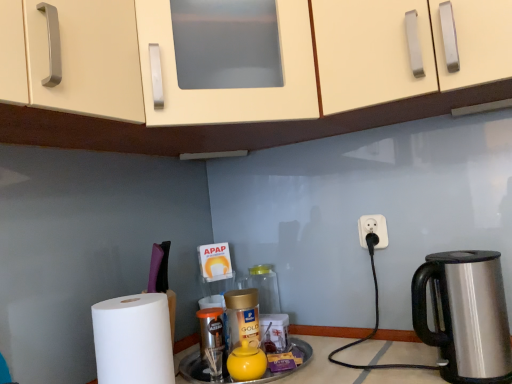
What do you see at coordinates (296, 80) in the screenshot?
I see `matte cream cabinet at upper center` at bounding box center [296, 80].

Describe the element at coordinates (373, 230) in the screenshot. This screenshot has width=512, height=384. I see `white plastic power outlet at right` at that location.

What do you see at coordinates (265, 287) in the screenshot? I see `gold metallic jar at center, the first bottle in the back-to-front sequence` at bounding box center [265, 287].

Where is `gold plastic bottle at center, which ranks as the 1th bottle in front-to-back order`? The image size is (512, 384). gold plastic bottle at center, which ranks as the 1th bottle in front-to-back order is located at coordinates (242, 318).

This screenshot has width=512, height=384. Describe the element at coordinates (133, 340) in the screenshot. I see `white matte paper towel at lower left` at that location.

Identify the location of white matte paper towel at lower left. This screenshot has height=384, width=512. (133, 340).

Find the location of a particular element. The image size is (512, 384). matte cream cabinet at upper center is located at coordinates (296, 80).

Does matte cream cabinet at upper center appear on the left side of yellow matte tea pot at center?

No.

Is matte cream cabinet at upper center wider or thinner than yellow matte tea pot at center?

matte cream cabinet at upper center is wider than yellow matte tea pot at center.

Is matte cream cabinet at upper center positioned far away from yellow matte tea pot at center?

No, there isn't a large distance between matte cream cabinet at upper center and yellow matte tea pot at center.

Is matte cream cabinet at upper center facing towards yellow matte tea pot at center?

No, matte cream cabinet at upper center is not turned towards yellow matte tea pot at center.

How much distance is there between white matte paper towel at lower left and white plastic power outlet at right?

A distance of 26.30 inches exists between white matte paper towel at lower left and white plastic power outlet at right.

Is white matte paper towel at lower left facing away from white plastic power outlet at right?

No, white plastic power outlet at right is not at the back of white matte paper towel at lower left.

Is white matte paper towel at lower left in front of or behind white plastic power outlet at right in the image?

white matte paper towel at lower left is positioned closer to the viewer than white plastic power outlet at right.

Between white matte paper towel at lower left and white plastic power outlet at right, which one appears on the right side from the viewer's perspective?

From the viewer's perspective, white plastic power outlet at right appears more on the right side.

Which object is more forward, stainless steel kettle at right or white plastic power outlet at right?

stainless steel kettle at right is more forward.

Can you confirm if stainless steel kettle at right is thinner than white plastic power outlet at right?

No, stainless steel kettle at right is not thinner than white plastic power outlet at right.

Is white plastic power outlet at right a part of stainless steel kettle at right?

No, white plastic power outlet at right is located outside of stainless steel kettle at right.

Is gold metallic jar at center, positioned as the 2th bottle in front-to-back order, in front of or behind white plastic power outlet at right in the image?

gold metallic jar at center, positioned as the 2th bottle in front-to-back order, is positioned farther from the viewer than white plastic power outlet at right.

Can you confirm if gold metallic jar at center, the first bottle in the back-to-front sequence, is shorter than white plastic power outlet at right?

No.

Is gold metallic jar at center, positioned as the 2th bottle in front-to-back order, touching white plastic power outlet at right?

No, gold metallic jar at center, positioned as the 2th bottle in front-to-back order, is not beside white plastic power outlet at right.

Locate an element on the screen. The height and width of the screenshot is (384, 512). power outlet above the gold metallic jar at center, the first bottle in the back-to-front sequence (from a real-world perspective) is located at coordinates (373, 230).

Which object is closer to the camera, stainless steel kettle at right or yellow matte tea pot at center?

stainless steel kettle at right is closer to the camera.

Is point (505, 331) positioned behind point (261, 350)?

No, (505, 331) is closer to viewer.

Looking at their sizes, would you say stainless steel kettle at right is wider or thinner than yellow matte tea pot at center?

In the image, stainless steel kettle at right appears to be wider than yellow matte tea pot at center.

Is stainless steel kettle at right wider than gold plastic bottle at center, which ranks as the 1th bottle in front-to-back order?

Yes, stainless steel kettle at right is wider than gold plastic bottle at center, which ranks as the 1th bottle in front-to-back order.

From a real-world perspective, who is located lower, stainless steel kettle at right or gold plastic bottle at center, which is the second bottle in back-to-front order?

In real-world perspective, gold plastic bottle at center, which is the second bottle in back-to-front order, is lower.

Considering the relative positions of stainless steel kettle at right and gold plastic bottle at center, which is the second bottle in back-to-front order, in the image provided, is stainless steel kettle at right to the left of gold plastic bottle at center, which is the second bottle in back-to-front order, from the viewer's perspective?

Incorrect, stainless steel kettle at right is not on the left side of gold plastic bottle at center, which is the second bottle in back-to-front order.

From a real-world perspective, count 2nd bottles downward from the stainless steel kettle at right and point to it. Please provide its 2D coordinates.

[(242, 318)]

Is matte cream cabinet at upper center smaller than gold metallic jar at center, positioned as the 2th bottle in front-to-back order?

No.

Considering the positions of point (362, 55) and point (249, 285), is point (362, 55) closer or farther from the camera than point (249, 285)?

Point (362, 55) is closer to the camera than point (249, 285).

Consider the image. Could you measure the distance between matte cream cabinet at upper center and gold metallic jar at center, positioned as the 2th bottle in front-to-back order?

They are 27.35 inches apart.

Does matte cream cabinet at upper center have a greater height compared to gold metallic jar at center, positioned as the 2th bottle in front-to-back order?

Indeed, matte cream cabinet at upper center has a greater height compared to gold metallic jar at center, positioned as the 2th bottle in front-to-back order.

This screenshot has height=384, width=512. What are the coordinates of `tea pot behind the matte cream cabinet at upper center` in the screenshot? It's located at (246, 362).

You are a GUI agent. You are given a task and a screenshot of the screen. Output one action in this format:
    pyautogui.click(x=<x>, y=<y>)
    Task: Click on the paper towel that is below the white plastic power outlet at right (from the image's perspective)
    The width and height of the screenshot is (512, 384).
    Given the screenshot: What is the action you would take?
    pyautogui.click(x=133, y=340)

Which object lies further to the anchor point yellow matte tea pot at center, gold plastic bottle at center, which is the second bottle in back-to-front order, or white plastic power outlet at right?

white plastic power outlet at right is positioned further to the anchor yellow matte tea pot at center.

Which object lies further to the anchor point gold plastic bottle at center, which ranks as the 1th bottle in front-to-back order, gold metallic jar at center, positioned as the 2th bottle in front-to-back order, or yellow matte tea pot at center?

gold metallic jar at center, positioned as the 2th bottle in front-to-back order, is positioned further to the anchor gold plastic bottle at center, which ranks as the 1th bottle in front-to-back order.

Which object lies further to the anchor point stainless steel kettle at right, yellow matte tea pot at center or matte cream cabinet at upper center?

Based on the image, matte cream cabinet at upper center appears to be further to stainless steel kettle at right.

Looking at the image, which one is located closer to gold metallic jar at center, the first bottle in the back-to-front sequence, stainless steel kettle at right or yellow matte tea pot at center?

yellow matte tea pot at center is closer to gold metallic jar at center, the first bottle in the back-to-front sequence.

Estimate the real-world distances between objects in this image. Which object is further from yellow matte tea pot at center, stainless steel kettle at right or white plastic power outlet at right?

white plastic power outlet at right is further to yellow matte tea pot at center.

Considering their positions, is gold plastic bottle at center, which is the second bottle in back-to-front order, positioned closer to stainless steel kettle at right than matte cream cabinet at upper center?

Among the two, gold plastic bottle at center, which is the second bottle in back-to-front order, is located nearer to stainless steel kettle at right.

From the image, which object appears to be nearer to gold metallic jar at center, positioned as the 2th bottle in front-to-back order, white plastic power outlet at right or white matte paper towel at lower left?

The object closer to gold metallic jar at center, positioned as the 2th bottle in front-to-back order, is white plastic power outlet at right.

Consider the image. Which object lies further to the anchor point gold plastic bottle at center, which ranks as the 1th bottle in front-to-back order, gold metallic jar at center, positioned as the 2th bottle in front-to-back order, or stainless steel kettle at right?

stainless steel kettle at right.

At what (x,y) coordinates should I click in order to perform the action: click on coffeepot between matte cream cabinet at upper center and gold metallic jar at center, the first bottle in the back-to-front sequence, vertically. Please return your answer as a coordinate pair (x, y). The width and height of the screenshot is (512, 384). Looking at the image, I should click on (466, 315).

What are the coordinates of `paper towel between matte cream cabinet at upper center and yellow matte tea pot at center in the vertical direction` in the screenshot? It's located at coord(133,340).

This screenshot has width=512, height=384. Find the location of `bottle between gold plastic bottle at center, which is the second bottle in back-to-front order, and stainless steel kettle at right`. bottle between gold plastic bottle at center, which is the second bottle in back-to-front order, and stainless steel kettle at right is located at coordinates (265, 287).

Locate an element on the screen. bottle situated between gold plastic bottle at center, which is the second bottle in back-to-front order, and white plastic power outlet at right from left to right is located at coordinates (265, 287).